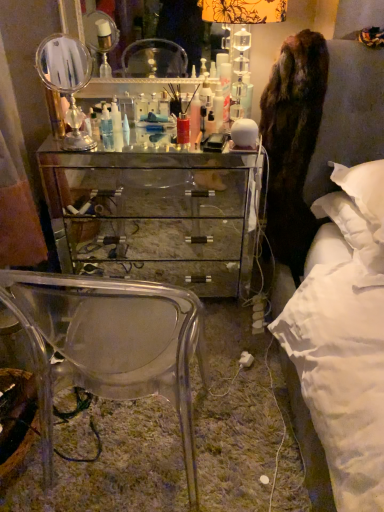
This screenshot has height=512, width=384. In order to click on free space between translucent plastic bottle at center, arranged as the third toiletry when viewed from the right, and white glossy bottle at center, the third toiletry positioned from the left in this screenshot , I will do `click(159, 137)`.